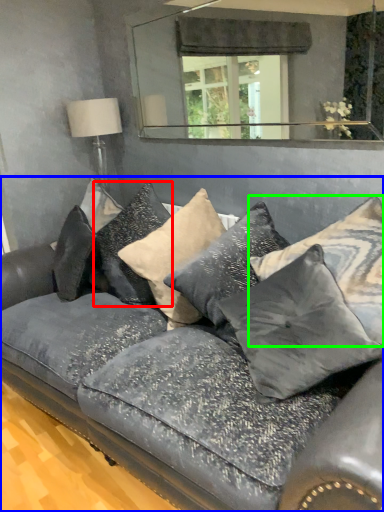
Question: Considering the real-world distances, which object is farthest from pillow (highlighted by a red box)? studio couch (highlighted by a blue box) or pillow (highlighted by a green box)?

Choices:
 (A) studio couch
 (B) pillow

Answer: (B)